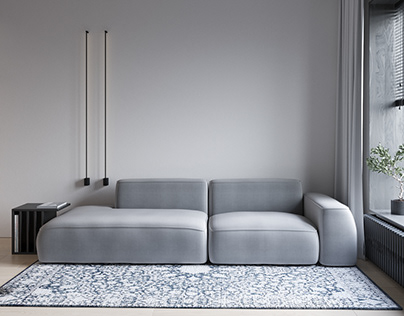
I want to click on rug, so click(246, 292).